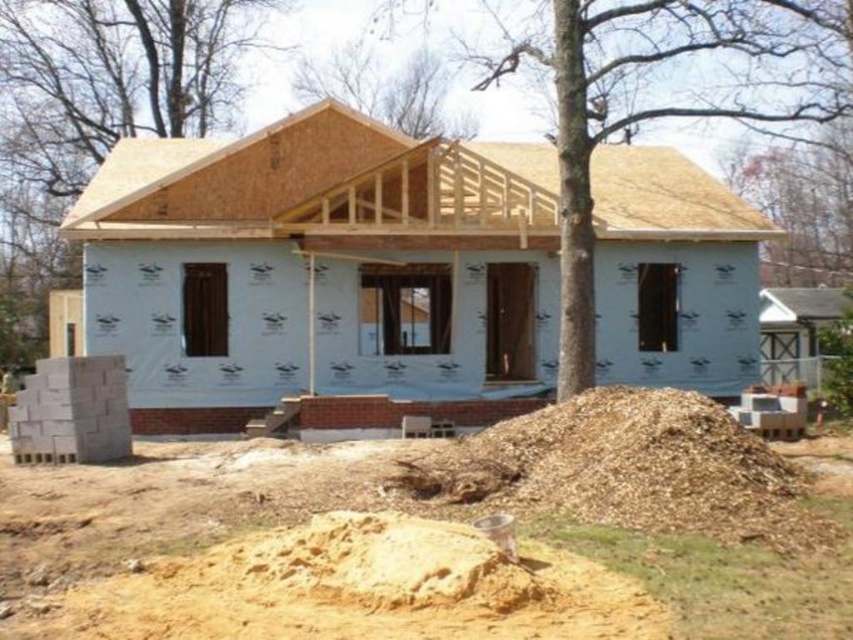
You are an architect reviewing the construction site. You need to locate the light brown wood at upper center. According to the coordinates provided, where exactly is it positioned?

The light brown wood at upper center is positioned at the 2D coordinates point (317,182).